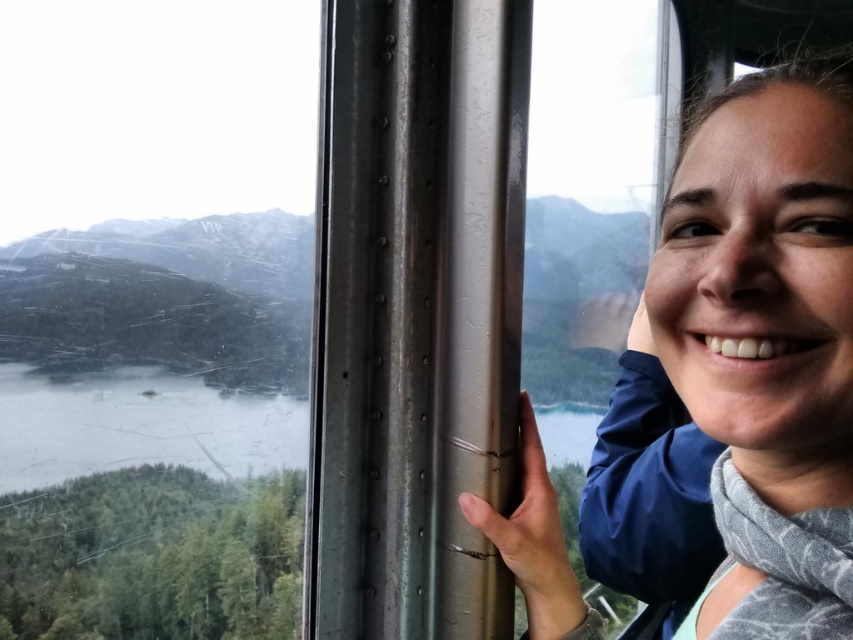
What do you see at coordinates (764, 346) in the screenshot? I see `matte blue jacket at right` at bounding box center [764, 346].

Is point (784, 122) positioned after point (212, 467)?

No, (784, 122) is closer to viewer.

Where is `matte blue jacket at right`? matte blue jacket at right is located at coordinates pos(764,346).